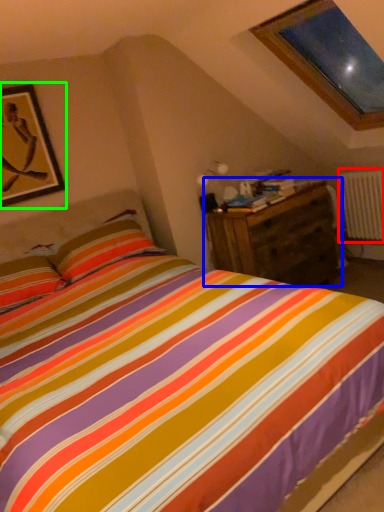
Question: Considering the real-world distances, which object is closest to radiator (highlighted by a red box)? nightstand (highlighted by a blue box) or picture frame (highlighted by a green box).

Choices:
 (A) nightstand
 (B) picture frame

Answer: (A)